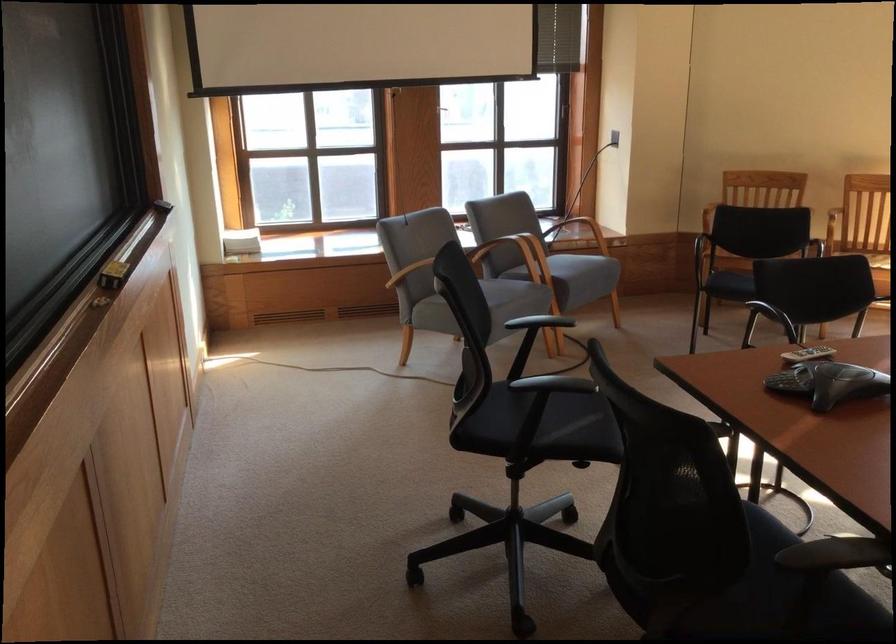
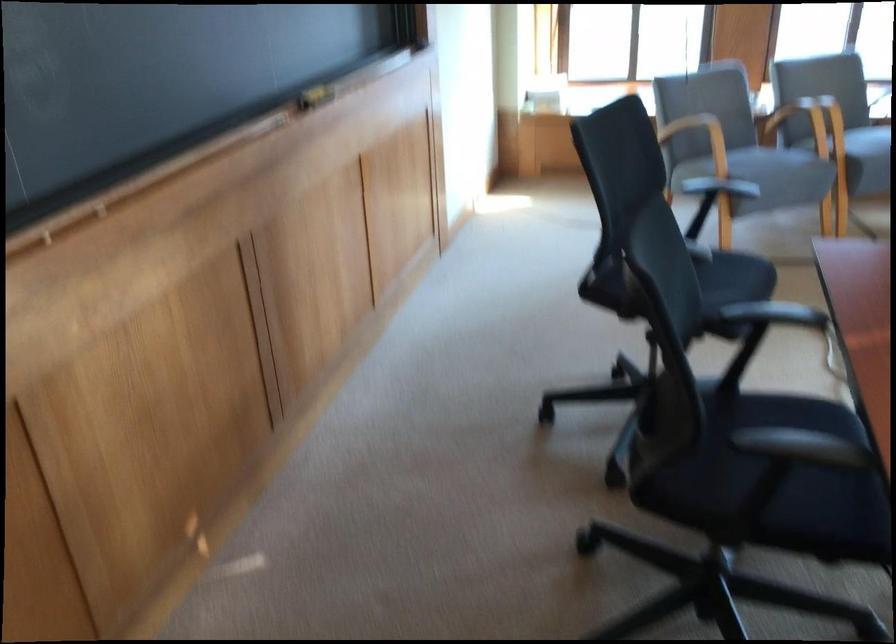
Where in the second image is the point corresponding to point (576, 411) from the first image?

(717, 285)